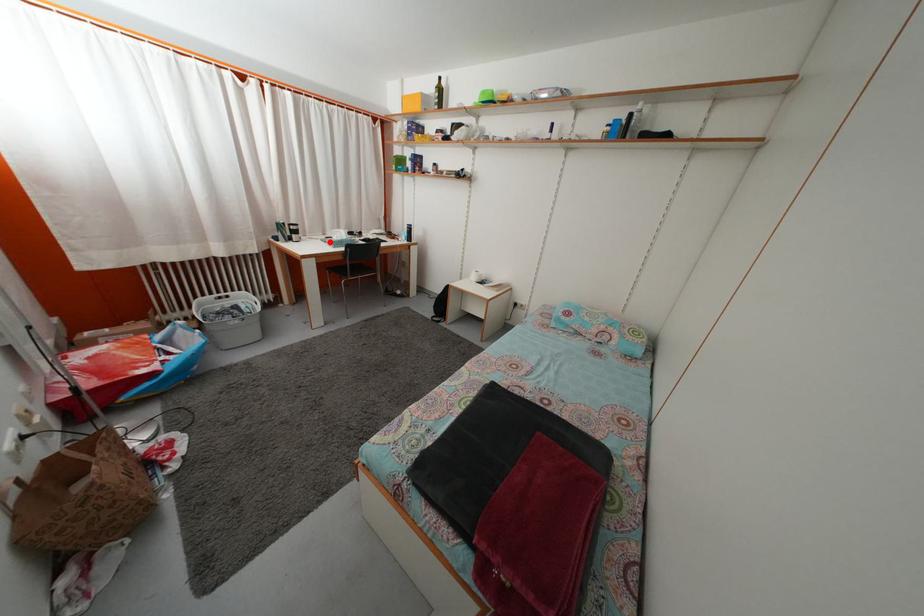
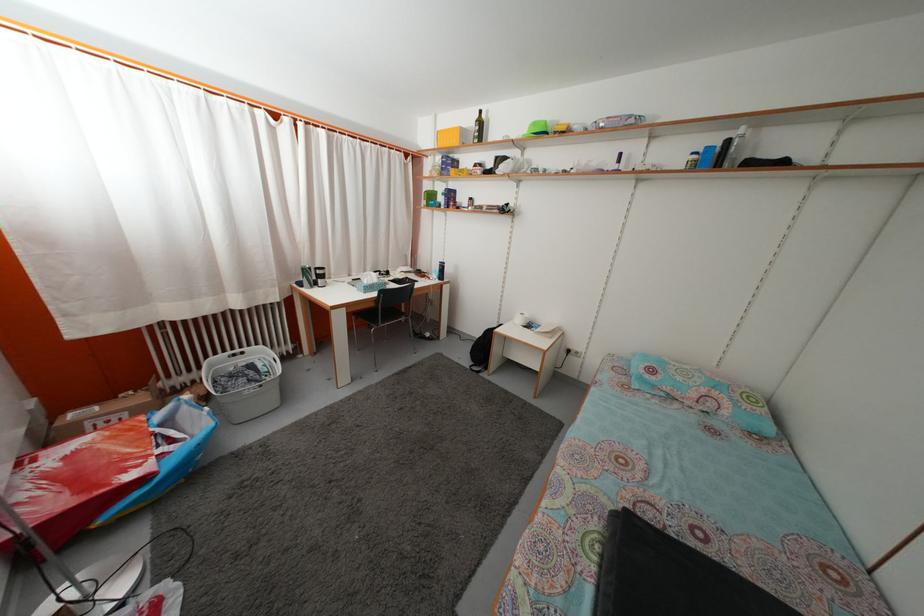
In the second image, find the point that corresponds to the highlighted location in the first image.

(355, 283)